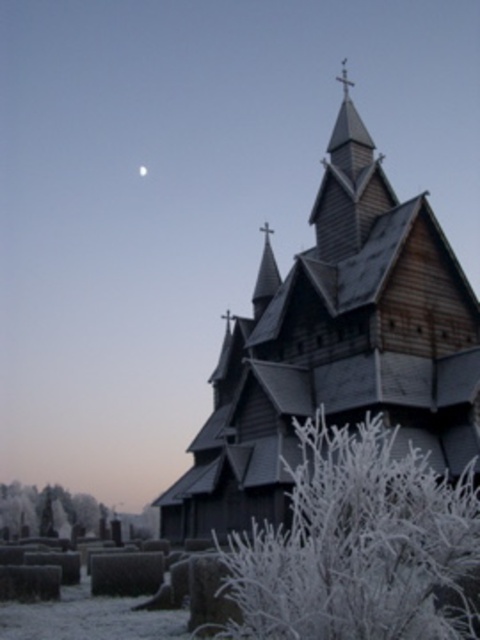
What do you see at coordinates (336, 346) in the screenshot? Image resolution: width=480 pixels, height=640 pixels. I see `wooden church at center` at bounding box center [336, 346].

Can you confirm if wooden church at center is positioned to the right of frosted white branches at center?

No, wooden church at center is not to the right of frosted white branches at center.

Which is in front, point (264, 324) or point (470, 566)?

Point (470, 566)

Where is `wooden church at center`? The height and width of the screenshot is (640, 480). wooden church at center is located at coordinates (336, 346).